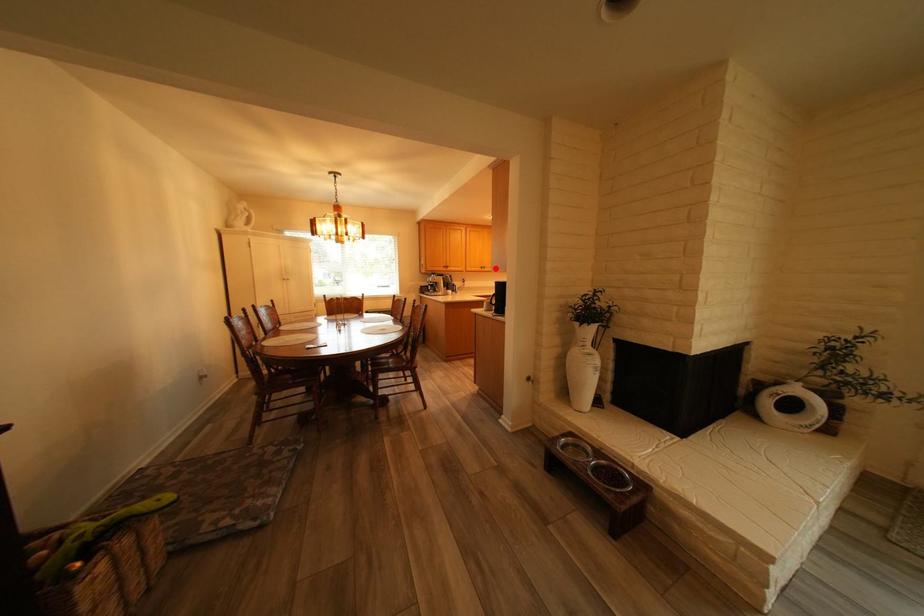
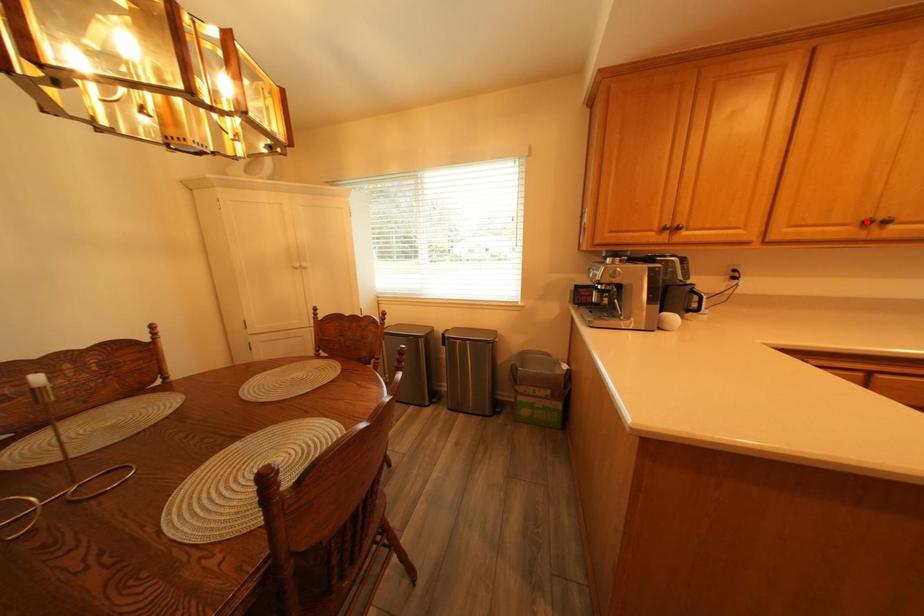
Based on the photo, I am providing you with two images of the same scene from different viewpoints. A red point is marked on the first image and another point is marked on the second image. Are the points marked in image1 and image2 representing the same 3D position?

No